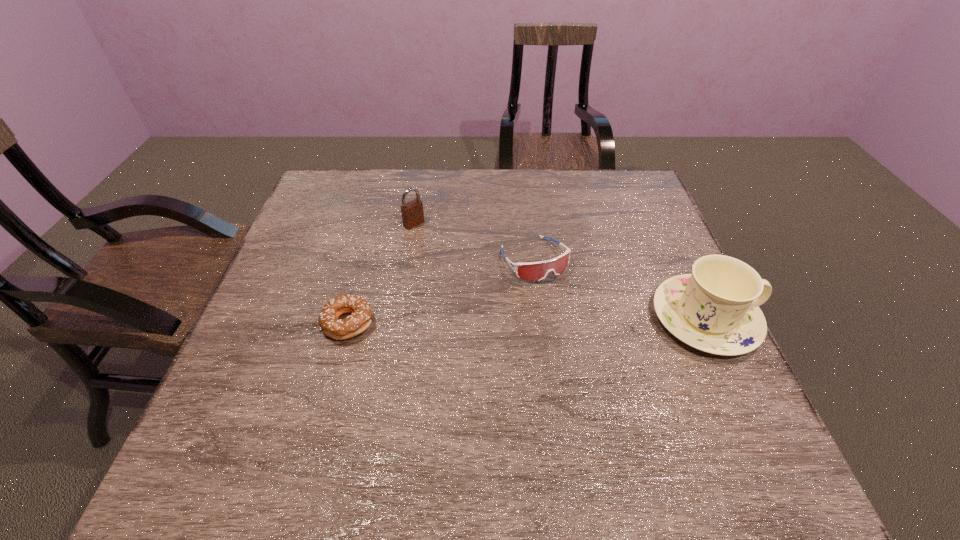
Where is `free space located on the front-facing side of the farthest object`? This screenshot has width=960, height=540. free space located on the front-facing side of the farthest object is located at coordinates (506, 296).

Find the location of a particular element. The height and width of the screenshot is (540, 960). vacant area located on the front-facing side of the second shortest object is located at coordinates (608, 364).

What are the coordinates of `free location located on the front-facing side of the second shortest object` in the screenshot? It's located at coord(645,418).

Where is `vacant space positioned on the front-facing side of the second shortest object`? The image size is (960, 540). vacant space positioned on the front-facing side of the second shortest object is located at coordinates (615, 376).

This screenshot has width=960, height=540. I want to click on object at the left edge, so click(340, 329).

Find the location of a particular element. This screenshot has width=960, height=540. object that is at the right edge is located at coordinates (715, 309).

Find the location of a particular element. free space at the far edge is located at coordinates (392, 180).

Locate an element on the screen. This screenshot has height=540, width=960. vacant area at the near edge of the desktop is located at coordinates (307, 406).

Find the location of a particular element. This screenshot has height=540, width=960. free point at the left edge is located at coordinates (347, 223).

Image resolution: width=960 pixels, height=540 pixels. In the image, there is a desktop. Find the location of `free space at the right edge`. free space at the right edge is located at coordinates (642, 341).